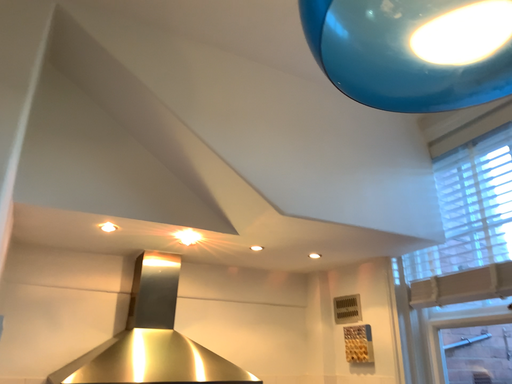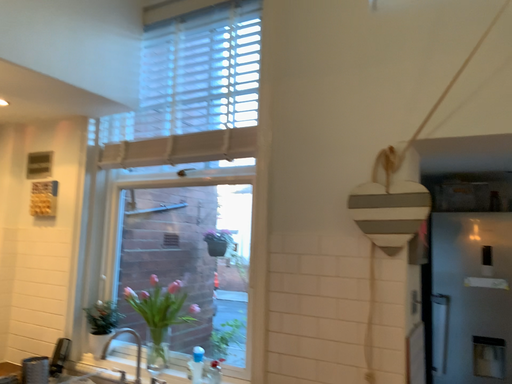
Question: Which way did the camera rotate in the video?

Choices:
 (A) rotated downward
 (B) rotated upward

Answer: (A)